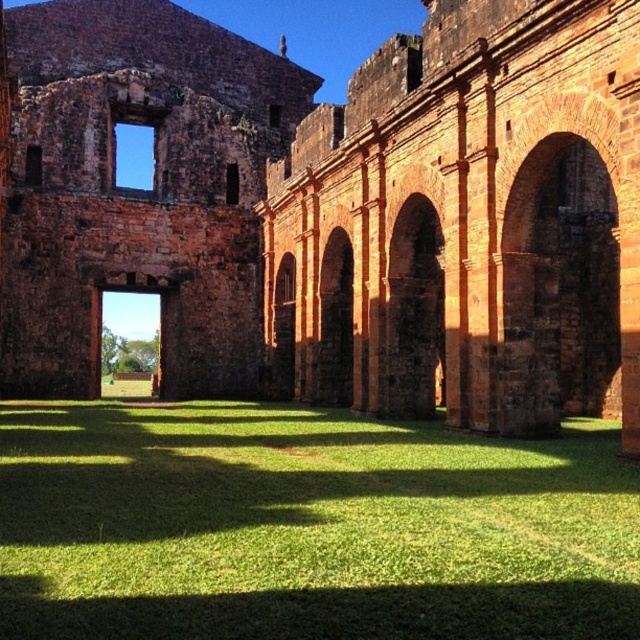
Question: Is brown stone archway at center bigger than red brick archway at center?

Choices:
 (A) yes
 (B) no

Answer: (A)

Question: Does green grass at center appear under red brick archway at center?

Choices:
 (A) no
 (B) yes

Answer: (B)

Question: Which of the following is the closest to the observer?

Choices:
 (A) brown stone arches at center
 (B) green grass at center
 (C) red brick archway at center
 (D) brown stone archway at center

Answer: (B)

Question: Which of the following is the farthest from the observer?

Choices:
 (A) (348, 298)
 (B) (237, 138)
 (C) (422, 401)

Answer: (B)

Question: Is green grass at center smaller than red brick archway at center?

Choices:
 (A) no
 (B) yes

Answer: (A)

Question: Which object is the farthest from the green grass at center?

Choices:
 (A) red brick archway at center
 (B) brown stone archway at center

Answer: (A)